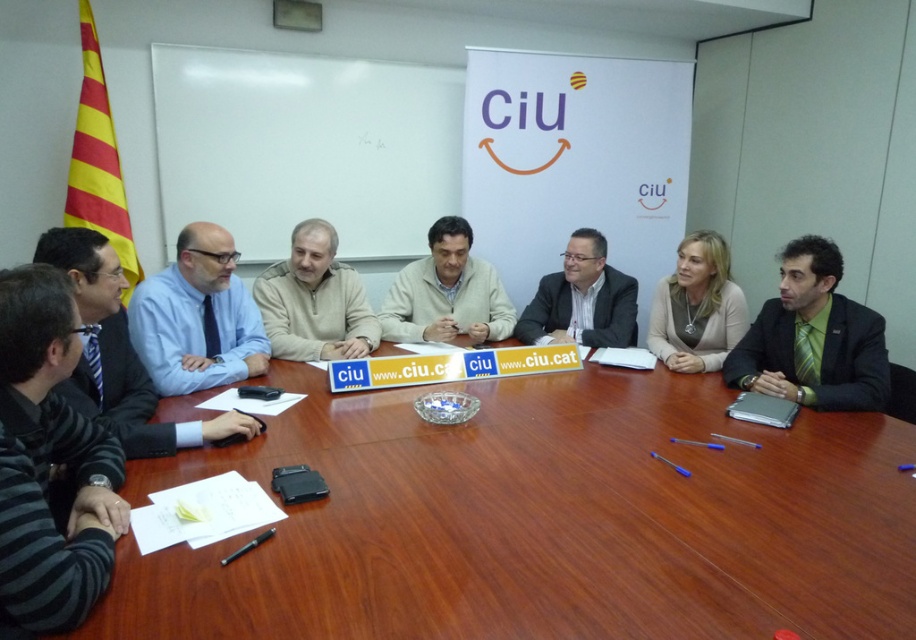
You are a guest attending this meeting and notice two items on the left side of the table. One is a striped sweater at left and the other is a blue striped tie at left. Which item is closer to the floor?

The striped sweater at left is closer to the floor because it is below the blue striped tie at left.

You are a person standing in the conference room. You want to reach a point that is 1.24 meters away from the camera. Is the point at coordinates point (347, 604) within reach if you can stretch your arm 1.2 meters?

The distance of point (347, 604) from camera is 1.24 meters, so the point is slightly out of reach since your arm can only stretch 1.2 meters.

You are attending a meeting and need to determine which item is taller between the striped sweater at left and the blue striped tie at left. Which one is taller?

The striped sweater at left is taller than the blue striped tie at left.